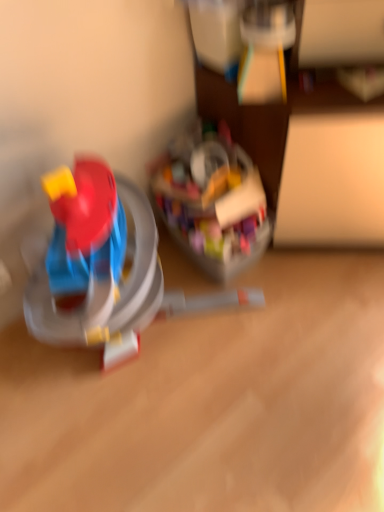
Question: From a real-world perspective, is translucent plastic toy at center, marked as the second toy in a right-to-left arrangement, positioned above or below translucent plastic container at center, acting as the first toy starting from the right?

Choices:
 (A) below
 (B) above

Answer: (B)

Question: Is translucent plastic toy at center, marked as the second toy in a right-to-left arrangement, inside the boundaries of translucent plastic container at center, the 2th toy from the left, or outside?

Choices:
 (A) inside
 (B) outside

Answer: (B)

Question: Does point (84, 309) appear closer or farther from the camera than point (256, 204)?

Choices:
 (A) farther
 (B) closer

Answer: (B)

Question: Is point (231, 218) closer or farther from the camera than point (72, 331)?

Choices:
 (A) farther
 (B) closer

Answer: (A)

Question: From the image's perspective, is translucent plastic container at center, acting as the first toy starting from the right, located above or below translucent plastic toy at center, marked as the second toy in a right-to-left arrangement?

Choices:
 (A) above
 (B) below

Answer: (A)

Question: From a real-world perspective, relative to translucent plastic toy at center, marked as the second toy in a right-to-left arrangement, is translucent plastic container at center, acting as the first toy starting from the right, vertically above or below?

Choices:
 (A) above
 (B) below

Answer: (B)

Question: In the image, is translucent plastic container at center, the 2th toy from the left, on the left side or the right side of translucent plastic toy at center, marked as the second toy in a right-to-left arrangement?

Choices:
 (A) right
 (B) left

Answer: (A)